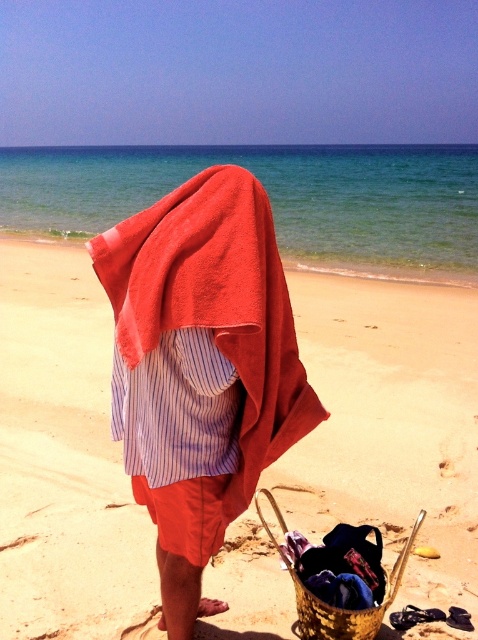
You are standing at the point labeled point (391, 426) in the image. What type of terrain are you currently standing on?

You are standing on sandy beach at center.